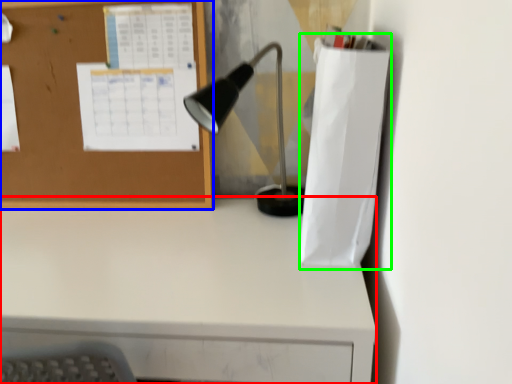
Question: Which is nearer to the desk (highlighted by a red box)? bulletin board (highlighted by a blue box) or paper bag (highlighted by a green box).

Choices:
 (A) bulletin board
 (B) paper bag

Answer: (B)